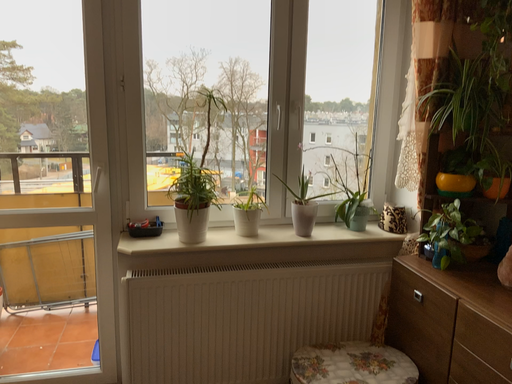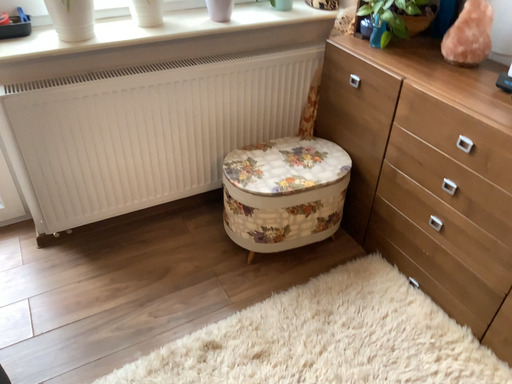
Question: How did the camera likely rotate when shooting the video?

Choices:
 (A) rotated left
 (B) rotated right

Answer: (B)